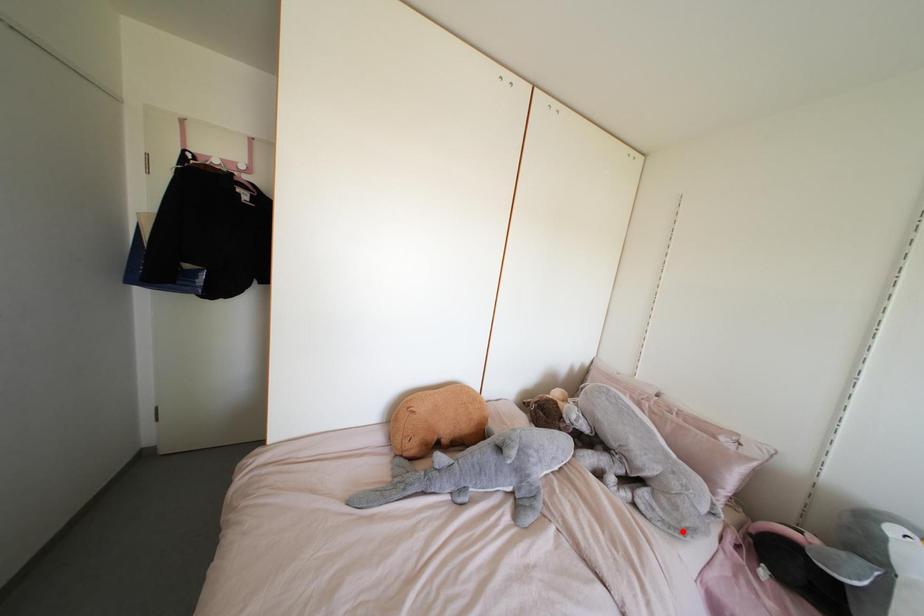
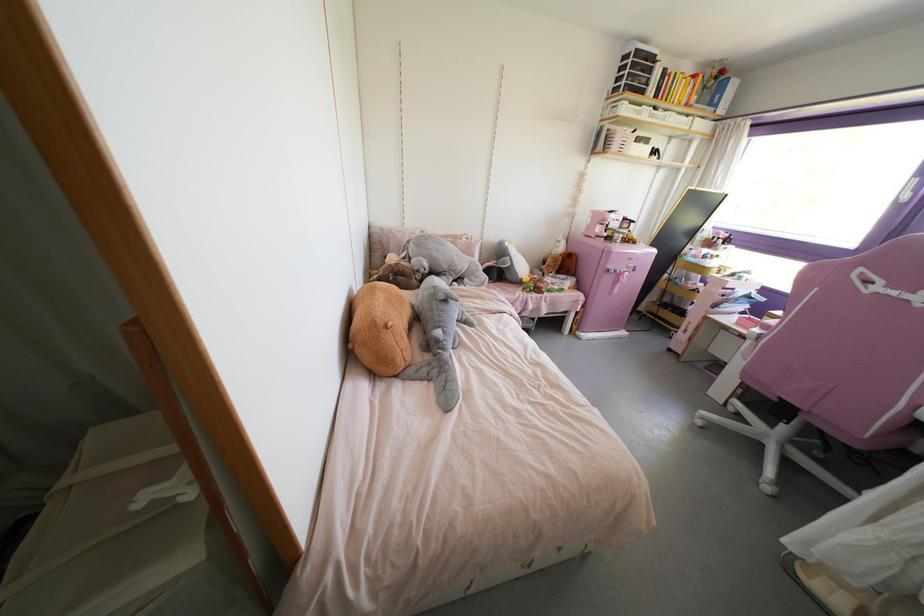
Where in the second image is the point corresponding to the highlighted location from the first image?

(482, 284)